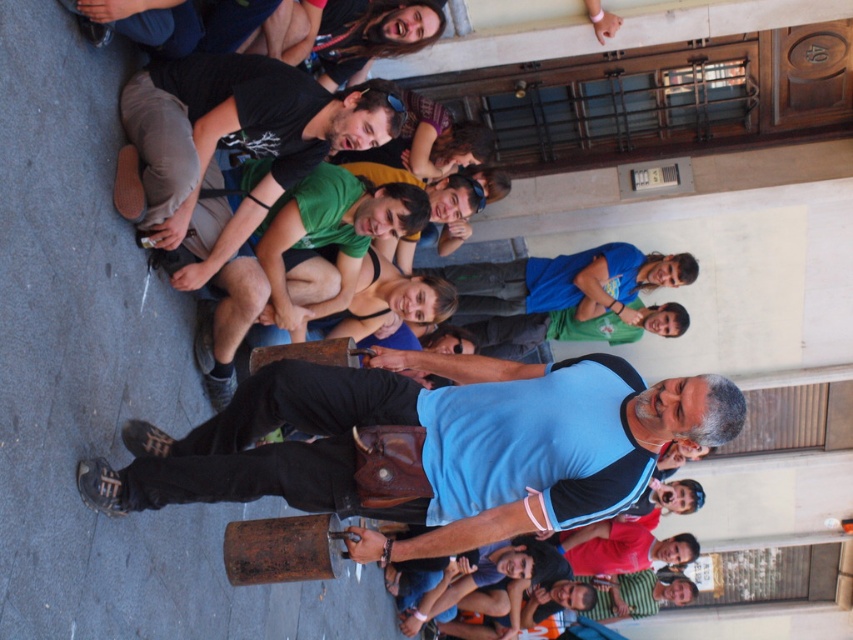
In the scene shown: You are a photographer trying to capture a candid shot of the blue fabric shirt at center and the green matte shirt at center in the street scene. To ensure both are in frame, should you position your camera to the left or the right of the group?

The blue fabric shirt at center is to the right of the green matte shirt at center, so positioning the camera to the left of the group would ensure both are in frame.

You are a photographer standing at the edge of the crowd. You want to take a picture of the blue fabric shirt at center. Where should you aim your camera to capture the shirt in the frame?

You should aim your camera at the point [431,445] to capture the blue fabric shirt at center in the frame.

You are a photographer trying to capture a clear photo of both the blue fabric shirt at center and the green matte shirt at center in the lively street scene. Since you want both subjects to appear equally prominent in the photo, which shirt should you zoom in more on and why?

The blue fabric shirt at center is larger than the green matte shirt at center. To make them appear equally prominent, you should zoom in more on the smaller green matte shirt at center to balance their sizes in the photo.